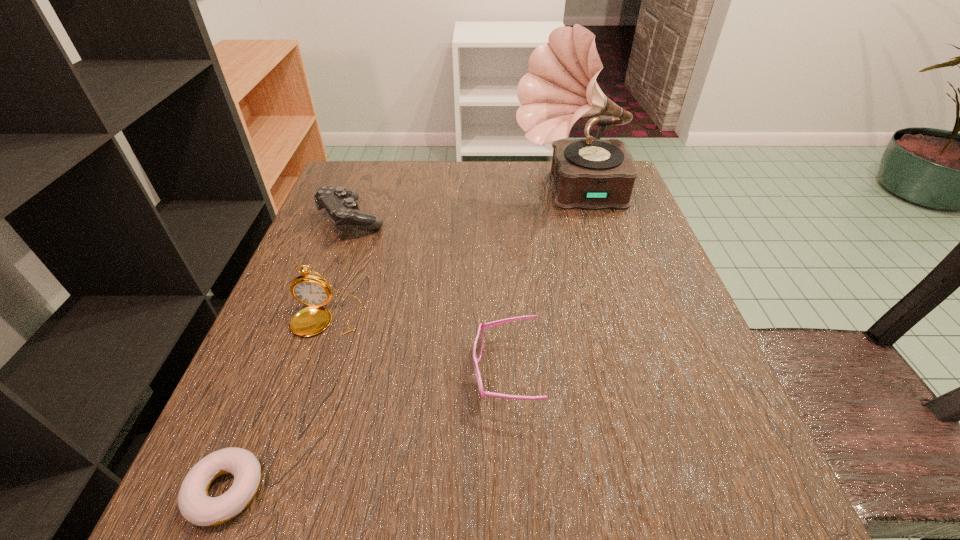
I want to click on doughnut that is positioned at the left edge, so click(195, 505).

Find the location of a particular element. This screenshot has width=960, height=540. object positioned at the right edge is located at coordinates (561, 87).

In order to click on object located in the far left corner section of the desktop in this screenshot , I will do `click(341, 203)`.

You are a GUI agent. You are given a task and a screenshot of the screen. Output one action in this format:
    pyautogui.click(x=<x>, y=<y>)
    Task: Click on the object located at the near left corner
    The image size is (960, 540).
    Given the screenshot: What is the action you would take?
    pyautogui.click(x=195, y=505)

At what (x,y) coordinates should I click in order to perform the action: click on object that is at the far right corner. Please return your answer as a coordinate pair (x, y). Looking at the image, I should click on (561, 87).

Where is `free space at the far edge of the desktop`? The height and width of the screenshot is (540, 960). free space at the far edge of the desktop is located at coordinates (538, 177).

This screenshot has height=540, width=960. Find the location of `free spot at the left edge of the desktop`. free spot at the left edge of the desktop is located at coordinates (368, 258).

Identify the location of free space at the right edge of the desktop. (601, 244).

I want to click on free space at the far left corner, so click(x=363, y=183).

Find the location of a particular element. The width and height of the screenshot is (960, 540). free space at the far right corner of the desktop is located at coordinates (633, 207).